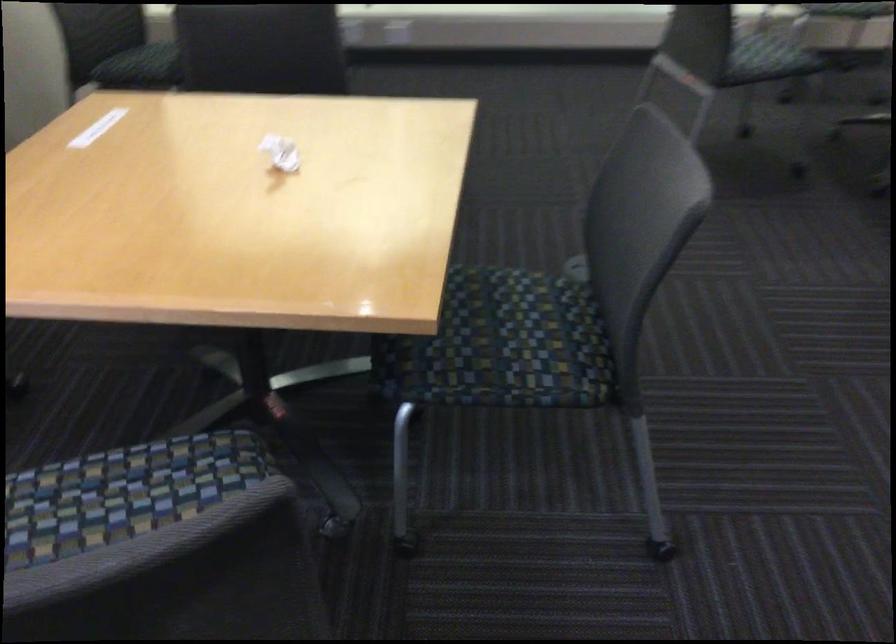
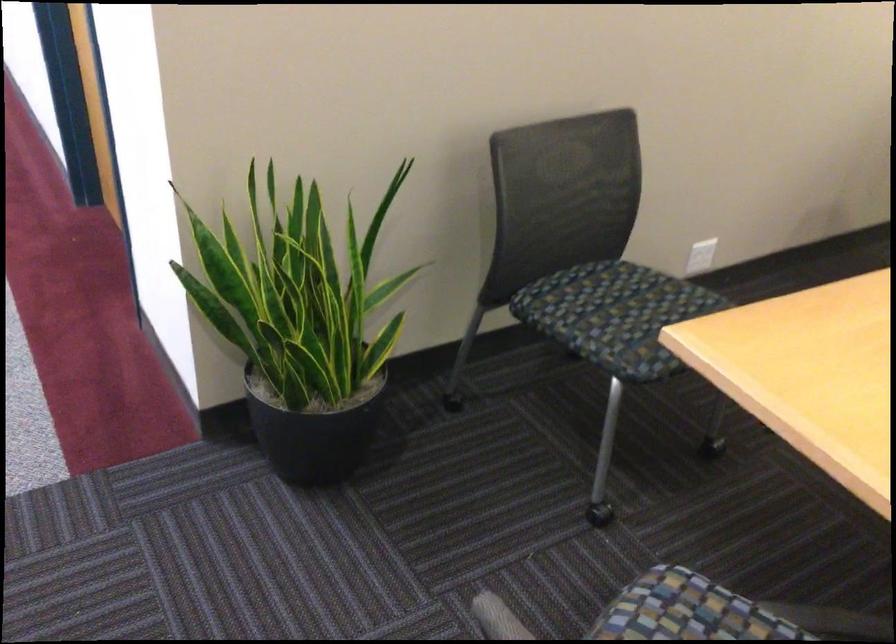
Question: The camera is either moving clockwise (left) or counter-clockwise (right) around the object. The first image is from the beginning of the video and the second image is from the end. Is the camera moving left or right when shooting the video?

Choices:
 (A) Left
 (B) Right

Answer: (B)